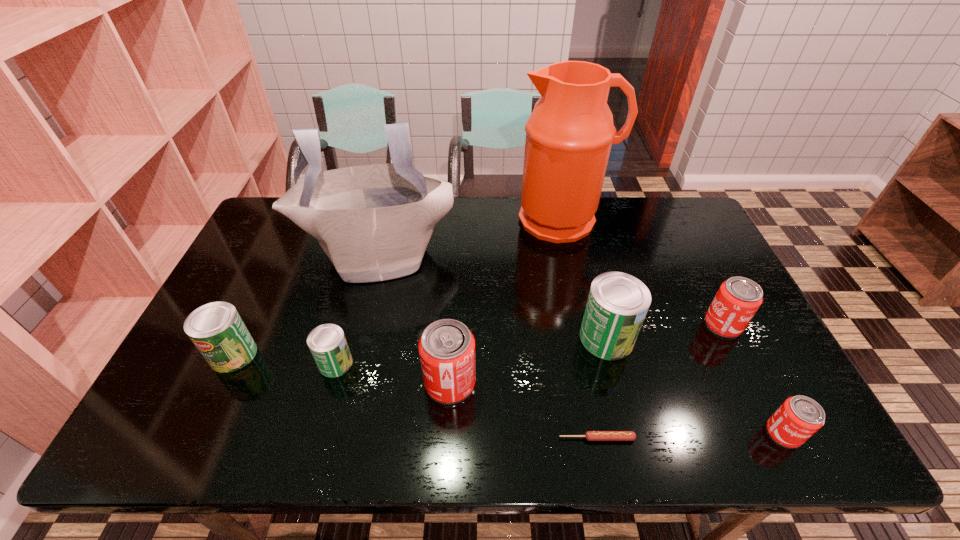
Identify the location of red can that stands as the second closest to the nearest can. This screenshot has height=540, width=960. (446, 348).

Where is `green can that is the second closest to the second smallest red can`? green can that is the second closest to the second smallest red can is located at coordinates (327, 343).

Identify the location of green can that stands as the third closest to the third can from left to right. The height and width of the screenshot is (540, 960). (216, 329).

You are a GUI agent. You are given a task and a screenshot of the screen. Output one action in this format:
    pyautogui.click(x=<x>, y=<y>)
    Task: Click on the free spot that satisfies the following two spatial constraints: 1. from the spout of the water jug; 2. on the right side of the second biggest red can
    Image resolution: width=960 pixels, height=540 pixels.
    Given the screenshot: What is the action you would take?
    pyautogui.click(x=586, y=325)

This screenshot has height=540, width=960. What are the coordinates of `free space that satisfies the following two spatial constraints: 1. from the spout of the orange water jug; 2. on the right side of the second smallest red can` in the screenshot? It's located at (586, 325).

Where is `free space that satisfies the following two spatial constraints: 1. from the spout of the water jug; 2. on the left side of the smallest red can`? Image resolution: width=960 pixels, height=540 pixels. free space that satisfies the following two spatial constraints: 1. from the spout of the water jug; 2. on the left side of the smallest red can is located at coordinates (610, 433).